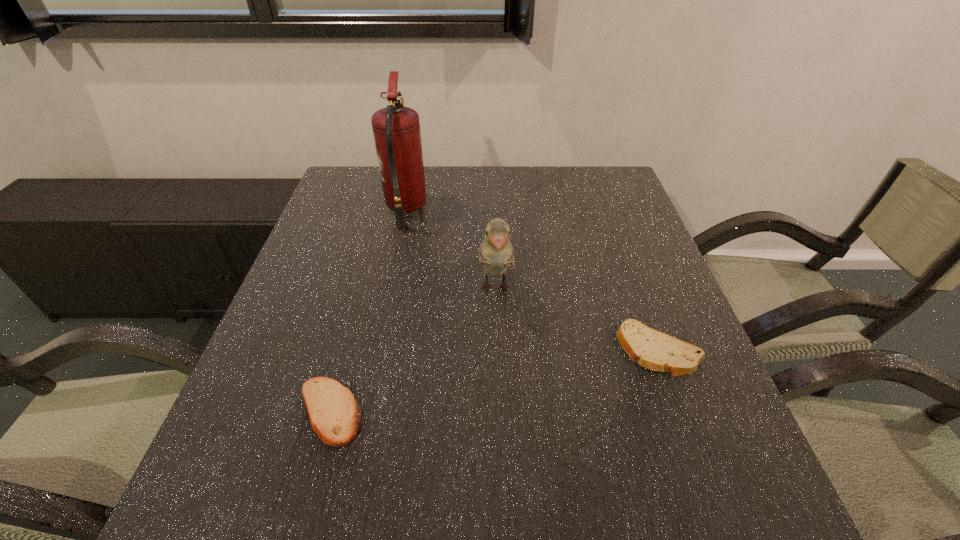
Locate an element on the screen. The height and width of the screenshot is (540, 960). vacant point at the near left corner is located at coordinates (220, 506).

The image size is (960, 540). I want to click on vacant region at the near right corner, so click(706, 511).

Find the location of a particular element. The width and height of the screenshot is (960, 540). free space between the second nearest object and the third shortest object is located at coordinates [x=577, y=319].

At what (x,y) coordinates should I click in order to perform the action: click on free point between the nearer pita bread and the second nearest object. Please return your answer as a coordinate pair (x, y). Looking at the image, I should click on (493, 381).

Image resolution: width=960 pixels, height=540 pixels. Find the location of `vacant point located between the second tallest object and the fire extinguisher`. vacant point located between the second tallest object and the fire extinguisher is located at coordinates (450, 248).

Image resolution: width=960 pixels, height=540 pixels. Identify the location of vacant point located between the nearer pita bread and the bird. (412, 350).

Locate an element on the screen. The height and width of the screenshot is (540, 960). empty space that is in between the third farthest object and the nearest object is located at coordinates (493, 381).

This screenshot has height=540, width=960. What are the coordinates of `free spot between the third farthest object and the farthest object` in the screenshot? It's located at (532, 280).

The width and height of the screenshot is (960, 540). I want to click on unoccupied area between the left pita bread and the farthest object, so click(368, 310).

Locate an element on the screen. This screenshot has height=540, width=960. free point between the right pita bread and the bird is located at coordinates (577, 319).